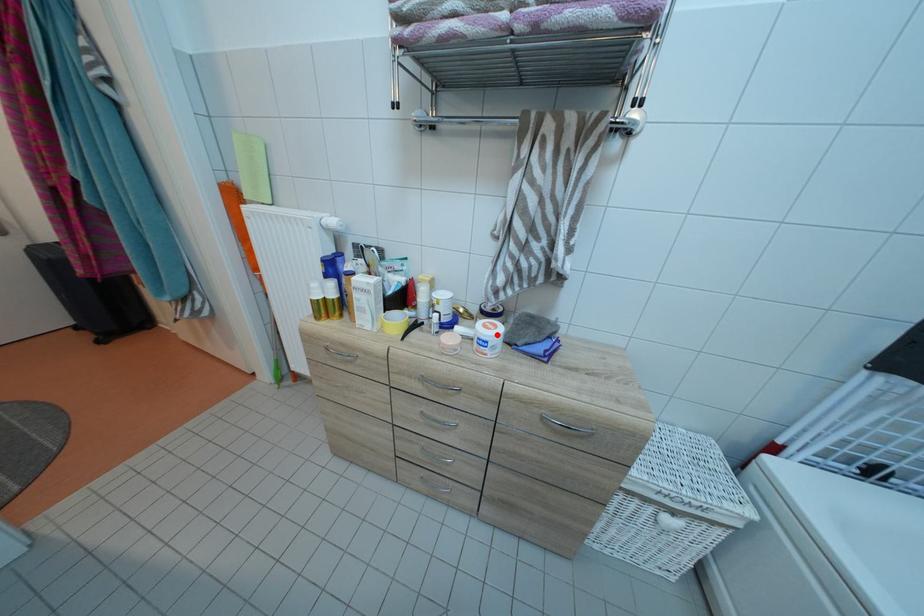
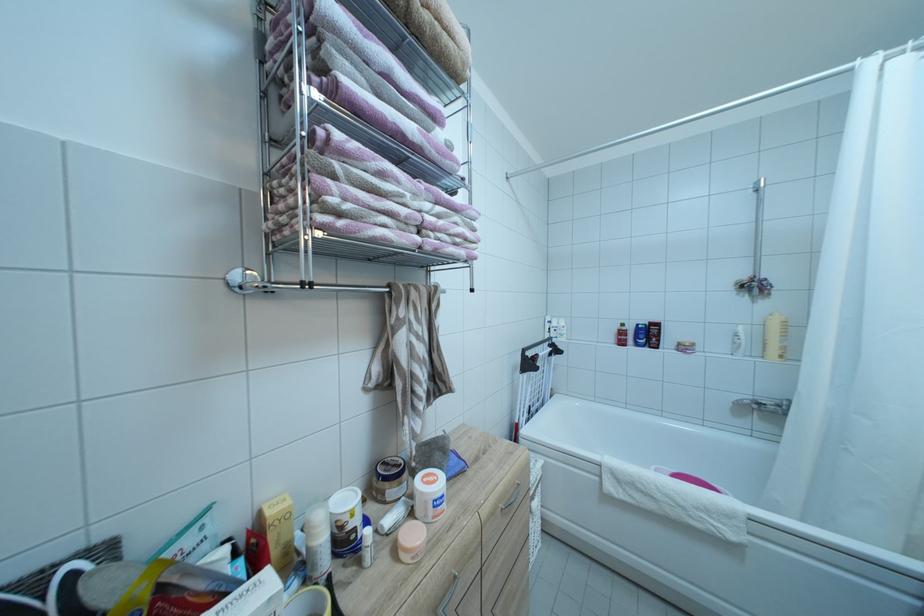
Find the pixel in the second image that matches the highlighted location in the first image.

(442, 487)